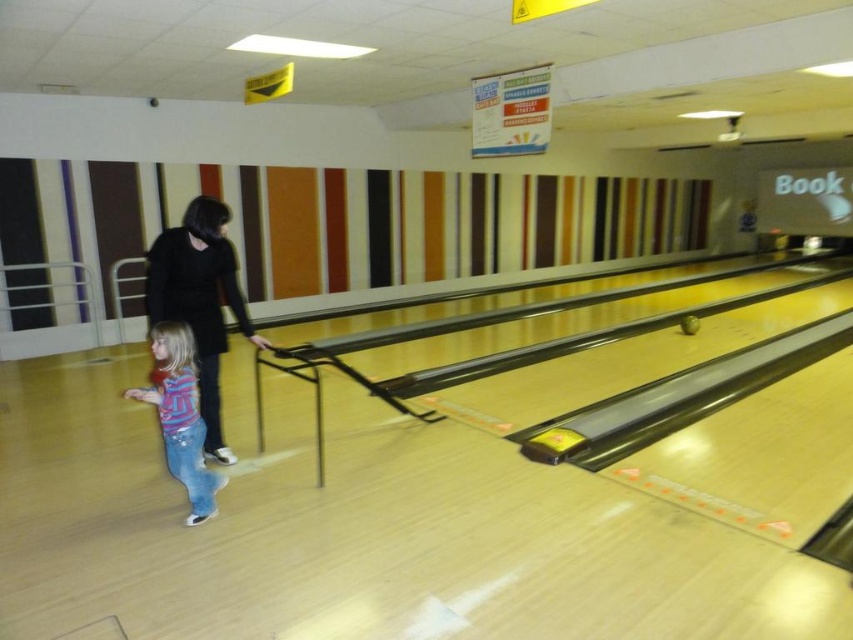
Is the position of black matte dress at center less distant than that of striped cotton shirt at lower left?

No, it is not.

Identify the location of black matte dress at center. This screenshot has width=853, height=640. (200, 300).

Identify the location of black matte dress at center. (200, 300).